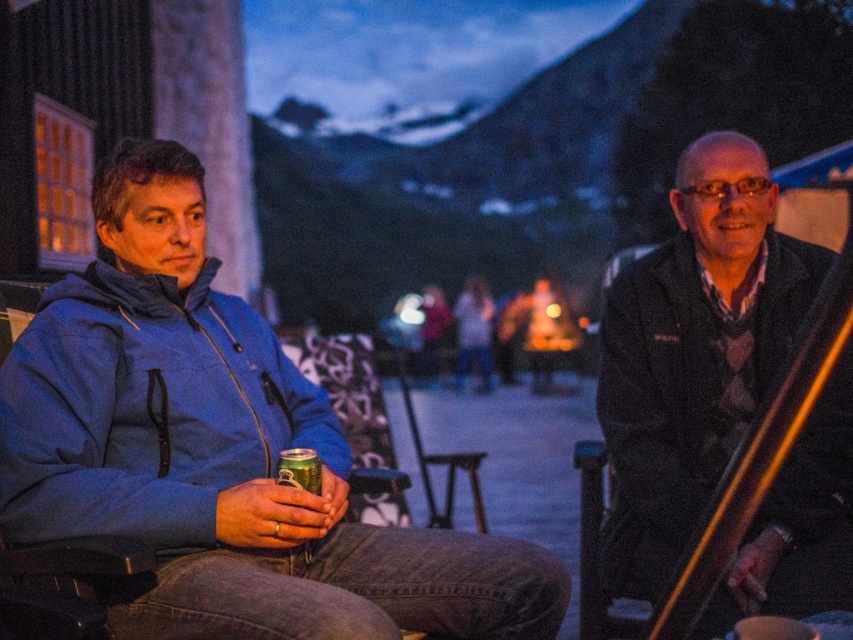
Question: Estimate the real-world distances between objects in this image. Which object is farther from the blue fleece jacket at left?

Choices:
 (A) dark gray sweater at right
 (B) blurred denim jacket at center
 (C) matte white sweater at center

Answer: (B)

Question: Which of the following is the closest to the observer?

Choices:
 (A) (509, 301)
 (B) (315, 445)
 (C) (195, 424)

Answer: (C)

Question: Can you confirm if blue fleece jacket at left is positioned to the left of matte white sweater at center?

Choices:
 (A) yes
 (B) no

Answer: (A)

Question: Estimate the real-world distances between objects in this image. Which object is farther from the blue fleece jacket at left?

Choices:
 (A) matte blue jacket at left
 (B) blurred denim jacket at center

Answer: (B)

Question: Does blue fleece jacket at left appear under blurred denim jacket at center?

Choices:
 (A) no
 (B) yes

Answer: (B)

Question: From the image, what is the correct spatial relationship of matte blue jacket at left in relation to matte white sweater at center?

Choices:
 (A) below
 (B) above

Answer: (A)